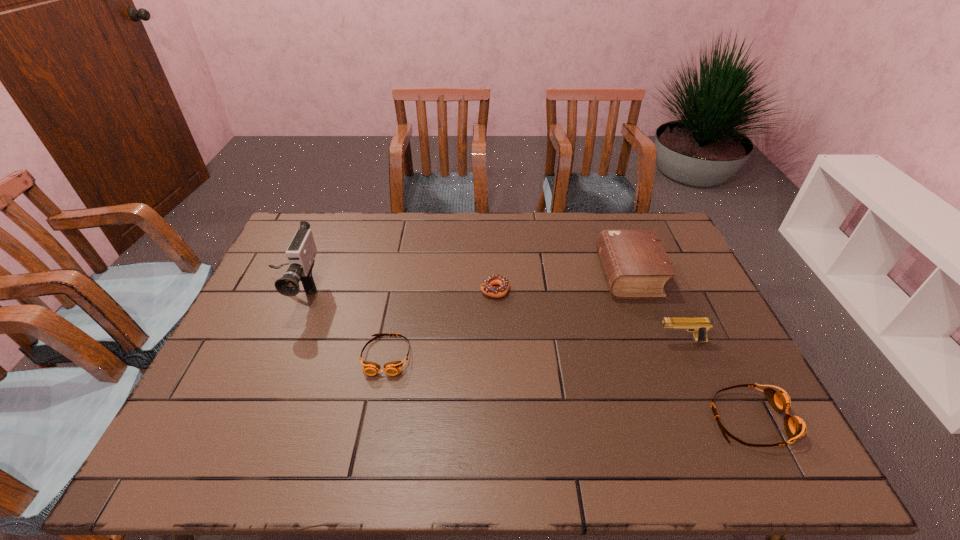
Locate an element on the screen. This screenshot has width=960, height=540. object located at the left edge is located at coordinates (302, 250).

Find the location of a particular element. The height and width of the screenshot is (540, 960). goggles positioned at the right edge is located at coordinates (795, 427).

Find the location of a particular element. Bible that is at the right edge is located at coordinates (636, 266).

Identify the location of pistol that is positioned at the right edge. The width and height of the screenshot is (960, 540). (699, 326).

Find the location of a particular element. This screenshot has width=960, height=540. object at the far right corner is located at coordinates (636, 266).

Identify the location of object located in the near right corner section of the desktop. This screenshot has width=960, height=540. (795, 427).

Find the location of a particular element. free point at the far edge is located at coordinates (614, 224).

This screenshot has height=540, width=960. What are the coordinates of `free space at the near edge of the desktop` in the screenshot? It's located at (478, 413).

I want to click on free space at the left edge, so click(278, 295).

Find the location of a particular element. The height and width of the screenshot is (540, 960). vacant space at the right edge of the desktop is located at coordinates (693, 285).